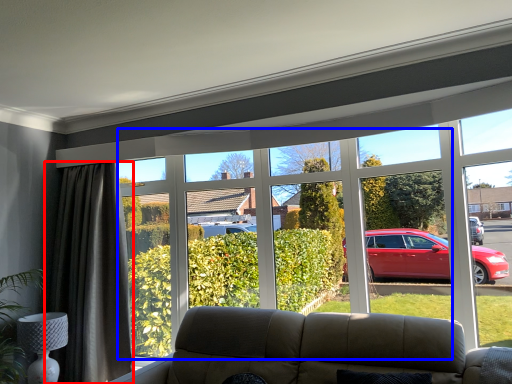
Question: Which object appears farthest to the camera in this image, curtain (highlighted by a red box) or bay window (highlighted by a blue box)?

Choices:
 (A) curtain
 (B) bay window

Answer: (A)